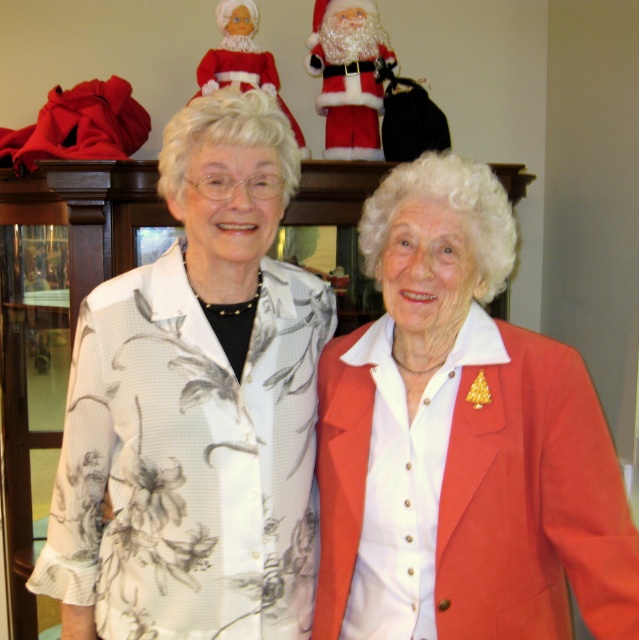
Question: Which point is closer to the camera?

Choices:
 (A) (475, 264)
 (B) (351, 38)

Answer: (A)

Question: Which point appears closest to the camera in this image?

Choices:
 (A) [433, 326]
 (B) [351, 157]

Answer: (A)

Question: Which object is closer to the camera taking this photo?

Choices:
 (A) fuzzy santa at upper center
 (B) matte red blazer at center

Answer: (B)

Question: Is matte red blazer at center below fuzzy santa at upper center?

Choices:
 (A) yes
 (B) no

Answer: (A)

Question: From the image, what is the correct spatial relationship of matte red blazer at center in relation to fuzzy santa at upper center?

Choices:
 (A) left
 (B) right

Answer: (B)

Question: Does matte red blazer at center have a larger size compared to fuzzy santa at upper center?

Choices:
 (A) no
 (B) yes

Answer: (B)